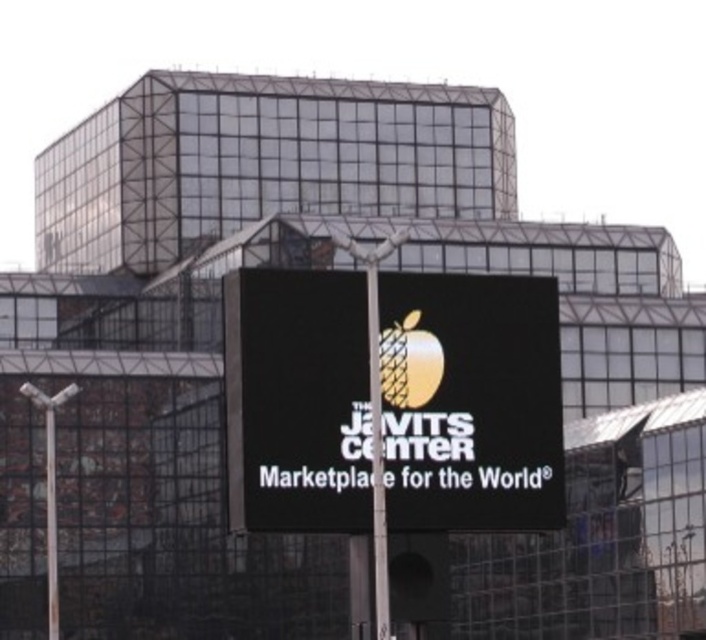
You are standing in front of The Javits Center and want to take a photo of both the point at coordinates (x=345, y=380) and the point at coordinates (x=369, y=342). Which point should you focus on first to ensure both are in focus?

You should focus on the point at coordinates (x=345, y=380) first because it is closer to you than the point at coordinates (x=369, y=342). This ensures that both points will be in focus when using depth of field.

You are standing in front of The Javits Center and notice a black digital sign at center and a metallic pole at center. Based on their positions, which object is wider?

The black digital sign at center might be wider than metallic pole at center according to the description.

You are standing in front of The Javits Center and want to locate the black digital sign at center. According to the coordinates provided, where should you look relative to the building?

The black digital sign at center is located at coordinates point [469,403], which is approximately two thirds of the way from the bottom to the top and slightly to the right of the center horizontally on the building facade.